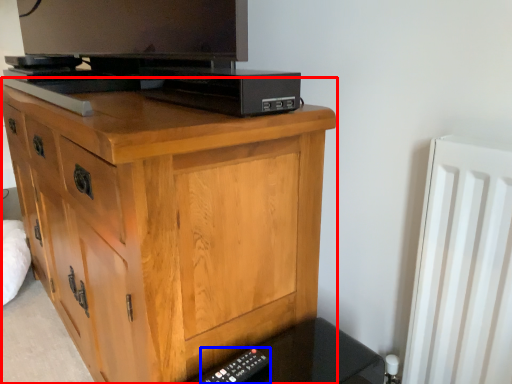
Question: Which point is further to the camera, chest of drawers (highlighted by a red box) or remote (highlighted by a blue box)?

Choices:
 (A) chest of drawers
 (B) remote

Answer: (B)